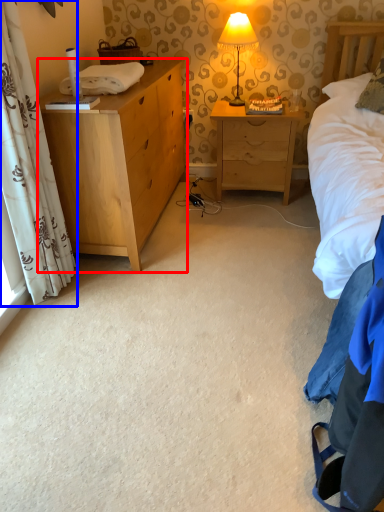
Question: Which object appears farthest to the camera in this image, chest of drawers (highlighted by a red box) or curtain (highlighted by a blue box)?

Choices:
 (A) chest of drawers
 (B) curtain

Answer: (A)